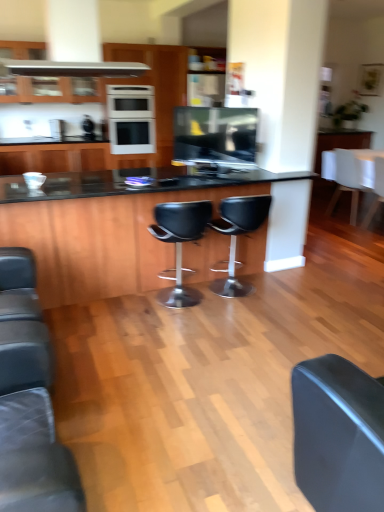
What do you see at coordinates (155, 91) in the screenshot?
I see `white glossy oven at upper center` at bounding box center [155, 91].

Measure the distance between point (x=372, y=182) and camera.

Point (x=372, y=182) and camera are 18.93 feet apart.

Find the location of a particular element. Image resolution: width=384 pixels, height=512 pixels. white matte chair at right, the first chair in the back-to-front sequence is located at coordinates (345, 175).

This screenshot has height=512, width=384. What do you see at coordinates (345, 175) in the screenshot?
I see `white matte chair at right, acting as the 2th chair starting from the right` at bounding box center [345, 175].

The height and width of the screenshot is (512, 384). What do you see at coordinates (215, 137) in the screenshot?
I see `flat screen tv at center` at bounding box center [215, 137].

What do you see at coordinates (376, 191) in the screenshot? I see `white fabric chair at right, which is the 2th chair in back-to-front order` at bounding box center [376, 191].

You are a GUI agent. You are given a task and a screenshot of the screen. Output one action in this format:
    pyautogui.click(x=<x>, y=<y>)
    Task: Click on the white glossy oven at upper center
    The width and height of the screenshot is (384, 512).
    Given the screenshot: What is the action you would take?
    pyautogui.click(x=155, y=91)

Which is more to the left, white glossy oven at upper center or flat screen tv at center?

white glossy oven at upper center is more to the left.

Does white glossy oven at upper center have a greater height compared to flat screen tv at center?

Yes, white glossy oven at upper center is taller than flat screen tv at center.

Is point (160, 152) positioned behind point (224, 138)?

Yes.

In terms of width, does white glossy oven at upper center look wider or thinner when compared to flat screen tv at center?

white glossy oven at upper center is wider than flat screen tv at center.

Is black leather stool at center, the 3th chair from the right, with black glass table at center?

No, black leather stool at center, the 3th chair from the right, is not making contact with black glass table at center.

Is black glass table at center at the back of black leather stool at center, the 3th chair from the right?

No, black glass table at center is not at the back of black leather stool at center, the 3th chair from the right.

From a real-world perspective, is black leather stool at center, placed as the third chair when sorted from back to front, above or below black glass table at center?

From a real-world perspective, black leather stool at center, placed as the third chair when sorted from back to front, is physically below black glass table at center.

Does white matte counter top at right contain white fabric chair at right, arranged as the 3th chair when viewed from the front?

No, white fabric chair at right, arranged as the 3th chair when viewed from the front, is not inside white matte counter top at right.

From the image's perspective, which chair is the 2nd one below the white matte counter top at right? Please provide its 2D coordinates.

[(376, 191)]

From a real-world perspective, between white matte counter top at right and white fabric chair at right, which is the 4th chair from left to right, who is vertically lower?

From a 3D spatial view, white fabric chair at right, which is the 4th chair from left to right, is below.

Can you confirm if white glossy oven at center is positioned to the left of white glossy oven at upper center?

Yes.

Which of these two, white glossy oven at center or white glossy oven at upper center, is wider?

Wider between the two is white glossy oven at upper center.

How different are the orientations of white glossy oven at center and white glossy oven at upper center in degrees?

There is a 0.466-degree angle between the facing directions of white glossy oven at center and white glossy oven at upper center.

Is white glossy oven at center positioned beyond the bounds of white glossy oven at upper center?

No, white glossy oven at center is inside white glossy oven at upper center's boundary.

Where is `cabinetry above the white fabric chair at right, which ranks as the 1th chair in right-to-left order (from the image's perspective)`? cabinetry above the white fabric chair at right, which ranks as the 1th chair in right-to-left order (from the image's perspective) is located at coordinates (155, 91).

Which of these two, white fabric chair at right, which is the 2th chair in back-to-front order, or white glossy oven at upper center, is thinner?

Thinner between the two is white fabric chair at right, which is the 2th chair in back-to-front order.

Consider the image. Considering the relative sizes of white fabric chair at right, which is the 2th chair in back-to-front order, and white glossy oven at upper center in the image provided, is white fabric chair at right, which is the 2th chair in back-to-front order, smaller than white glossy oven at upper center?

Yes.

Which is closer, [378,195] or [174,61]?

Point [378,195].

Would you say white fabric chair at right, which is the 2th chair in back-to-front order, is inside or outside black glass table at center?

white fabric chair at right, which is the 2th chair in back-to-front order, is not inside black glass table at center, it's outside.

Between white fabric chair at right, which is the 2th chair in back-to-front order, and black glass table at center, which one appears on the right side from the viewer's perspective?

From the viewer's perspective, white fabric chair at right, which is the 2th chair in back-to-front order, appears more on the right side.

From a real-world perspective, is white fabric chair at right, which is the 4th chair from left to right, positioned above or below black glass table at center?

In terms of real-world spatial position, white fabric chair at right, which is the 4th chair from left to right, is below black glass table at center.

Is black glass table at center taller or shorter than white glossy oven at center?

Clearly, black glass table at center is shorter compared to white glossy oven at center.

The image size is (384, 512). In order to click on table lying on the right of white glossy oven at center in this screenshot , I will do `click(107, 227)`.

From a real-world perspective, is black glass table at center below white glossy oven at center?

Correct, in the physical world, black glass table at center is lower than white glossy oven at center.

Does black glass table at center contain white glossy oven at center?

No.

This screenshot has height=512, width=384. I want to click on cabinetry that is behind the flat screen tv at center, so click(155, 91).

From a real-world perspective, which chair is the 4th one underneath the black glass table at center? Please provide its 2D coordinates.

[(237, 234)]

Considering their positions, is white matte chair at right, arranged as the 3th chair when viewed from the left, positioned closer to white glossy oven at center than white matte counter top at right?

white matte chair at right, arranged as the 3th chair when viewed from the left, is positioned closer to the anchor white glossy oven at center.

Looking at the image, which one is located closer to white matte chair at right, acting as the 2th chair starting from the right, white glossy oven at center or black leather stool at center, placed as the third chair when sorted from back to front?

Based on the image, white glossy oven at center appears to be nearer to white matte chair at right, acting as the 2th chair starting from the right.

Consider the image. Considering their positions, is black leather stool at center, placed as the first chair when sorted from left to right, positioned closer to white glossy oven at upper center than black leather stool at center, marked as the second chair in a left-to-right arrangement?

black leather stool at center, placed as the first chair when sorted from left to right.

Which object lies nearer to the anchor point white fabric chair at right, arranged as the 3th chair when viewed from the front, flat screen tv at center or white matte counter top at right?

white matte counter top at right lies closer to white fabric chair at right, arranged as the 3th chair when viewed from the front, than the other object.

When comparing their distances from black leather stool at center, the 3th chair from the right, does white glossy oven at upper center or black leather stool at center, arranged as the 1th chair when viewed from the front, seem closer?

The object closer to black leather stool at center, the 3th chair from the right, is black leather stool at center, arranged as the 1th chair when viewed from the front.

Estimate the real-world distances between objects in this image. Which object is closer to white matte counter top at right, black leather stool at center, marked as the second chair in a left-to-right arrangement, or white matte chair at right, the 4th chair positioned from the front?

white matte chair at right, the 4th chair positioned from the front, is positioned closer to the anchor white matte counter top at right.

Considering their positions, is white matte chair at right, arranged as the 3th chair when viewed from the left, positioned further to black glass table at center than white glossy oven at center?

Among the two, white matte chair at right, arranged as the 3th chair when viewed from the left, is located further to black glass table at center.

Based on their spatial positions, is white glossy oven at center or flat screen tv at center closer to black leather stool at center, placed as the third chair when sorted from back to front?

flat screen tv at center lies closer to black leather stool at center, placed as the third chair when sorted from back to front, than the other object.

You are a GUI agent. You are given a task and a screenshot of the screen. Output one action in this format:
    pyautogui.click(x=<x>, y=<y>)
    Task: Click on the table between white glossy oven at center and white matte chair at right, the 4th chair positioned from the front, in the horizontal direction
    
    Given the screenshot: What is the action you would take?
    pyautogui.click(x=107, y=227)

Identify the location of appliance located between white glossy oven at upper center and white matte counter top at right in the left-right direction. This screenshot has width=384, height=512. (215, 137).

Find the location of a particular element. The height and width of the screenshot is (512, 384). appliance between black leather stool at center, placed as the first chair when sorted from left to right, and white matte counter top at right is located at coordinates (215, 137).

Find the location of a particular element. The height and width of the screenshot is (512, 384). appliance between black leather stool at center, the 3th chair from the right, and white glossy oven at upper center in the front-back direction is located at coordinates (215, 137).